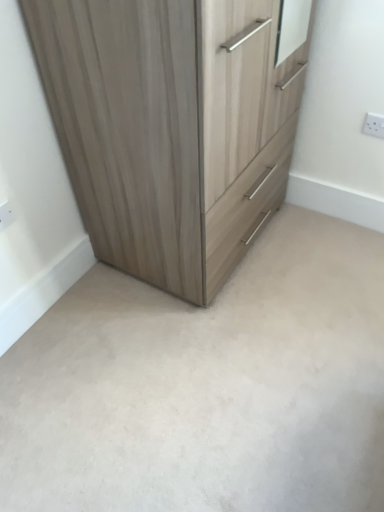
Identify the location of free space above beige carpet at center (from a real-world perspective). This screenshot has height=512, width=384. (211, 360).